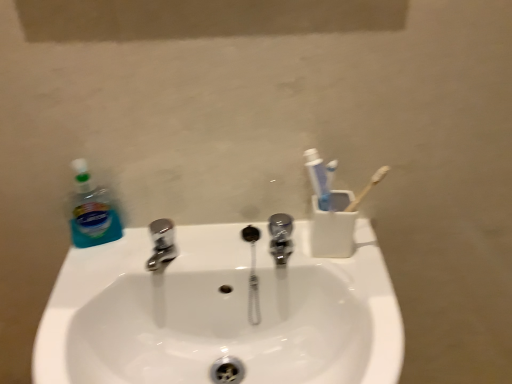
The image size is (512, 384). I want to click on polished chrome tap at center, so click(x=281, y=237).

Describe the element at coordinates (333, 227) in the screenshot. This screenshot has height=384, width=512. I see `white plastic toothbrush holder at upper right` at that location.

Where is `white glossy sink at center`? The height and width of the screenshot is (384, 512). white glossy sink at center is located at coordinates (220, 313).

From a real-world perspective, which is physically below, white plastic toothbrush holder at upper right or polished chrome tap at center?

polished chrome tap at center.

Could you tell me if white plastic toothbrush holder at upper right is facing polished chrome tap at center?

No, white plastic toothbrush holder at upper right is not oriented towards polished chrome tap at center.

From the image's perspective, which is below, white plastic toothbrush holder at upper right or polished chrome tap at center?

polished chrome tap at center is shown below in the image.

Is blue translucent liquid at left to the left of white glossy sink at center from the viewer's perspective?

Yes, blue translucent liquid at left is to the left of white glossy sink at center.

Could you tell me if blue translucent liquid at left is facing white glossy sink at center?

No, blue translucent liquid at left is not facing towards white glossy sink at center.

Which of these two, blue translucent liquid at left or white glossy sink at center, is smaller?

Smaller between the two is blue translucent liquid at left.

Where is `liquid that is above the polished chrome tap at center (from the image's perspective)`? liquid that is above the polished chrome tap at center (from the image's perspective) is located at coordinates (333, 227).

Is polished chrome tap at center taller or shorter than white plastic toothbrush holder at upper right?

In the image, polished chrome tap at center appears to be shorter than white plastic toothbrush holder at upper right.

Does point (277, 222) come in front of point (343, 246)?

No.

Is polished chrome tap at center at the back of white glossy sink at center?

That's not correct — white glossy sink at center is not looking away from polished chrome tap at center.

In the scene shown: Considering the sizes of objects white glossy sink at center and polished chrome tap at center in the image provided, who is bigger, white glossy sink at center or polished chrome tap at center?

With larger size is white glossy sink at center.

Is white glossy sink at center closer to the viewer compared to polished chrome tap at center?

Yes, white glossy sink at center is closer to the viewer.

Which is nearer, (330, 329) or (77, 180)?

The point (330, 329) is in front.

From the image's perspective, is white glossy sink at center on top of blue translucent liquid at left?

No, from the image's perspective, white glossy sink at center is not on top of blue translucent liquid at left.

Looking at the image, does white glossy sink at center seem bigger or smaller compared to blue translucent liquid at left?

Clearly, white glossy sink at center is larger in size than blue translucent liquid at left.

Does white glossy sink at center lie behind blue translucent liquid at left?

No.

Does white plastic toothbrush holder at upper right have a greater height compared to white glossy sink at center?

In fact, white plastic toothbrush holder at upper right may be shorter than white glossy sink at center.

Is point (331, 216) farther from viewer compared to point (63, 353)?

Yes, it is behind point (63, 353).

Is white plastic toothbrush holder at upper right completely or partially outside of white glossy sink at center?

No, white plastic toothbrush holder at upper right is not outside of white glossy sink at center.

From the image's perspective, does white plastic toothbrush holder at upper right appear higher than white glossy sink at center?

Yes, from the image's perspective, white plastic toothbrush holder at upper right is above white glossy sink at center.

Is blue translucent liquid at left next to white plastic toothbrush holder at upper right and touching it?

blue translucent liquid at left and white plastic toothbrush holder at upper right are not in contact.

Measure the distance between blue translucent liquid at left and white plastic toothbrush holder at upper right.

blue translucent liquid at left is 15.22 inches away from white plastic toothbrush holder at upper right.

From their relative heights in the image, would you say blue translucent liquid at left is taller or shorter than white plastic toothbrush holder at upper right?

Clearly, blue translucent liquid at left is taller compared to white plastic toothbrush holder at upper right.

From a real-world perspective, is blue translucent liquid at left on top of white plastic toothbrush holder at upper right?

Yes.

In order to click on tap below the white plastic toothbrush holder at upper right (from the image's perspective) in this screenshot , I will do pos(281,237).

What are the coordinates of `sink in front of the blue translucent liquid at left` in the screenshot? It's located at (220, 313).

From the picture: From the image, which object appears to be nearer to polished chrome tap at center, white glossy sink at center or white plastic toothbrush holder at upper right?

white plastic toothbrush holder at upper right is positioned closer to the anchor polished chrome tap at center.

Estimate the real-world distances between objects in this image. Which object is further from white plastic toothbrush holder at upper right, white glossy sink at center or blue translucent liquid at left?

blue translucent liquid at left is positioned further to the anchor white plastic toothbrush holder at upper right.

Estimate the real-world distances between objects in this image. Which object is further from white glossy sink at center, blue translucent liquid at left or white plastic toothbrush holder at upper right?

Among the two, blue translucent liquid at left is located further to white glossy sink at center.

When comparing their distances from polished chrome tap at center, does blue translucent liquid at left or white plastic toothbrush holder at upper right seem closer?

white plastic toothbrush holder at upper right.

Looking at the image, which one is located further to blue translucent liquid at left, polished chrome tap at center or white plastic toothbrush holder at upper right?

Among the two, white plastic toothbrush holder at upper right is located further to blue translucent liquid at left.

Looking at this image, from the image, which object appears to be nearer to blue translucent liquid at left, polished chrome tap at center or white glossy sink at center?

white glossy sink at center is positioned closer to the anchor blue translucent liquid at left.

When comparing their distances from white glossy sink at center, does polished chrome tap at center or white plastic toothbrush holder at upper right seem closer?

The object closer to white glossy sink at center is polished chrome tap at center.

Looking at the image, which one is located further to white glossy sink at center, white plastic toothbrush holder at upper right or polished chrome tap at center?

white plastic toothbrush holder at upper right is further to white glossy sink at center.

Where is `tap between blue translucent liquid at left and white plastic toothbrush holder at upper right`? Image resolution: width=512 pixels, height=384 pixels. tap between blue translucent liquid at left and white plastic toothbrush holder at upper right is located at coordinates (281, 237).

Image resolution: width=512 pixels, height=384 pixels. What are the coordinates of `tap between blue translucent liquid at left and white glossy sink at center in the up-down direction` in the screenshot? It's located at (281, 237).

This screenshot has height=384, width=512. I want to click on sink situated between blue translucent liquid at left and white plastic toothbrush holder at upper right from left to right, so click(220, 313).

I want to click on tap that lies between white plastic toothbrush holder at upper right and white glossy sink at center from top to bottom, so click(x=281, y=237).